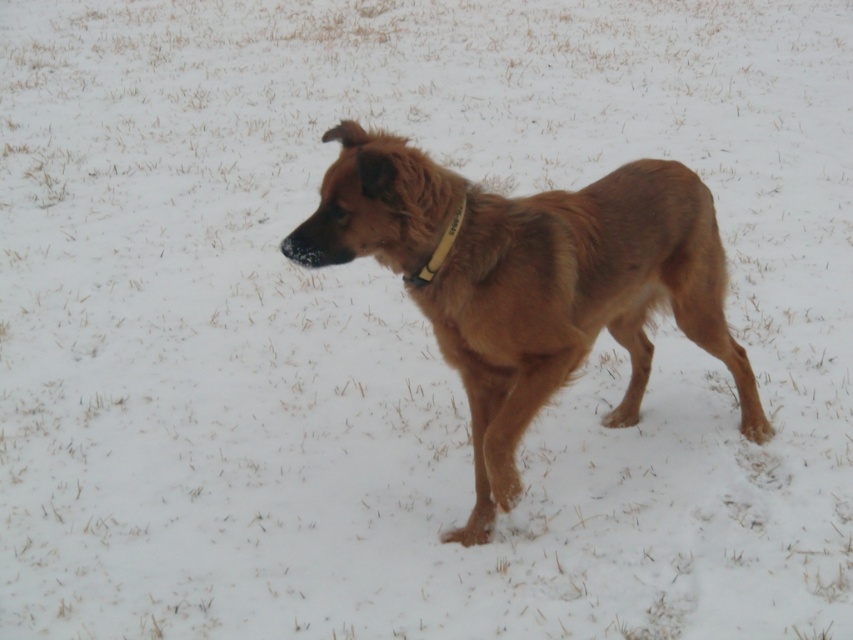
You are a photographer trying to capture the brown furry dog at center in the best possible lighting. Given the dim lighting conditions described in the scene, where should you position your camera to ensure the dog is well lit?

Since the scene has dim lighting due to overcast weather, positioning the camera so the brown furry dog at center faces a light source, like a window or open area, would help illuminate it better. However, the exact location depends on the direction of available light not specified in the description.

In the scene shown: You are an animal trainer assessing the dog in the image. You need to determine if the brown furry dog at center can comfortably wear a new collar that is 10 cm wider than its current yellow fabric neckband at center. Based on the dog and neckband dimensions, is this feasible?

The brown furry dog at center is wider than the yellow fabric neckband at center. Since the new collar would be 10 cm wider than the current neckband, and the dog is already wider than the neckband, the new collar would likely be too small to fit comfortably around the dog.